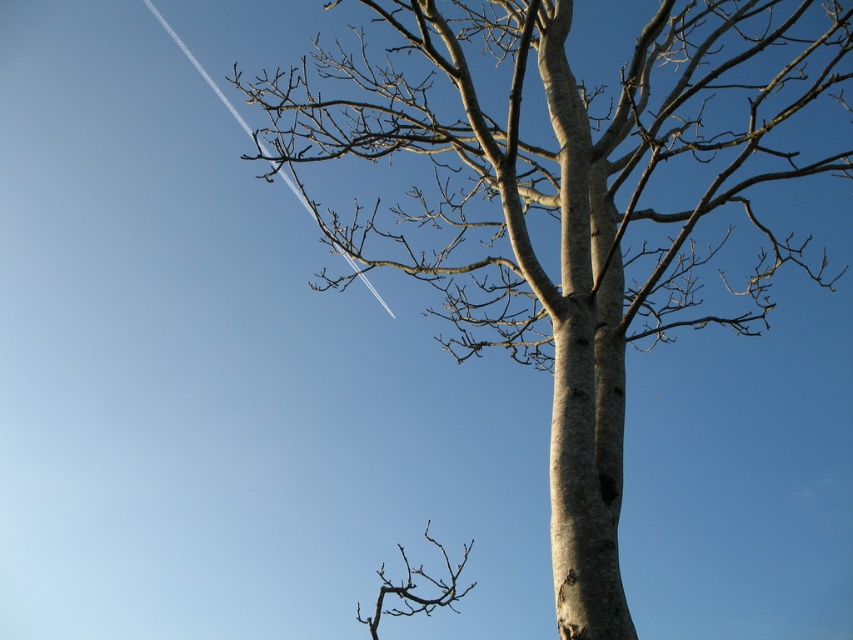
Question: Is smooth bark tree at center wider than brown rough branch at lower center?

Choices:
 (A) yes
 (B) no

Answer: (A)

Question: Which point appears farthest from the camera in this image?

Choices:
 (A) (804, 264)
 (B) (453, 564)

Answer: (B)

Question: Which of the following is the farthest from the observer?

Choices:
 (A) (474, 580)
 (B) (579, 202)

Answer: (A)

Question: Among these objects, which one is farthest from the camera?

Choices:
 (A) smooth bark tree at center
 (B) brown rough branch at lower center

Answer: (B)

Question: Where is smooth bark tree at center located in relation to brown rough branch at lower center in the image?

Choices:
 (A) below
 (B) above

Answer: (B)

Question: Is smooth bark tree at center bigger than brown rough branch at lower center?

Choices:
 (A) yes
 (B) no

Answer: (A)